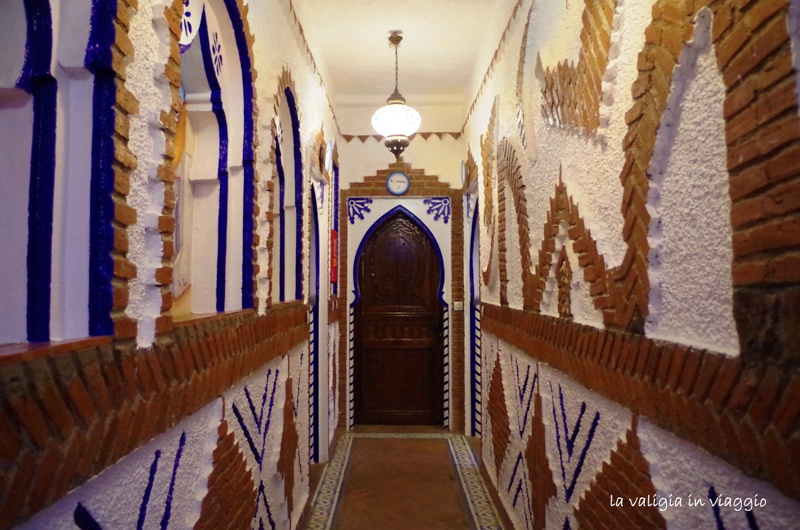
This screenshot has height=530, width=800. I want to click on window, so click(184, 211).